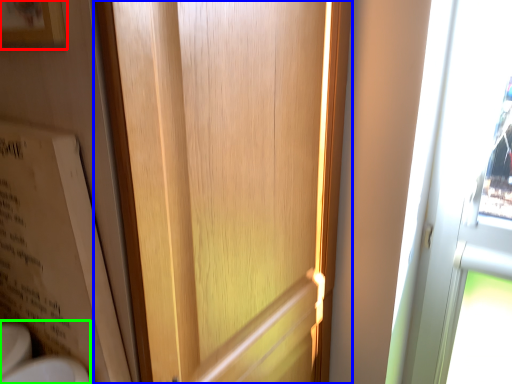
Question: Estimate the real-world distances between objects in this image. Which object is closer to picture frame (highlighted by a red box), door (highlighted by a blue box) or sink (highlighted by a green box)?

Choices:
 (A) door
 (B) sink

Answer: (A)